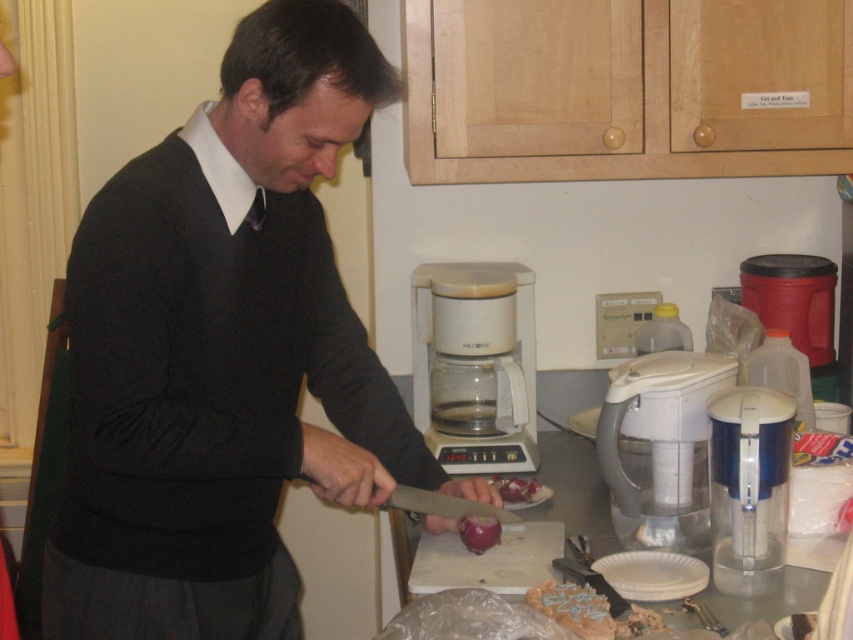
You are trying to find the transparent plastic coffee maker at center in the kitchen. According to the scene description, where exactly is it positioned relative to the other items on the counter?

The transparent plastic coffee maker at center is located at point coordinates of 0.572 on the x axis and 0.557 on the y axis.

You are a delivery person who just arrived at the kitchen. You need to place a new coffee maker that is 18 inches wide on the counter. The existing transparent plastic coffee maker at center is in the way. Can you move it to the left to make space without moving the matte black sweater at center?

The matte black sweater at center and transparent plastic coffee maker at center are 19.36 inches apart. Since the new coffee maker is 18 inches wide, moving the transparent plastic coffee maker at center to the left by at least 18 inches would create enough space. However, since they are only 19.36 inches apart, moving it 18 inches might bring it too close to the matte black sweater at center. A safer move would be to shift it slightly less than 19.36 inches to the left, ensuring the sweater remains undist